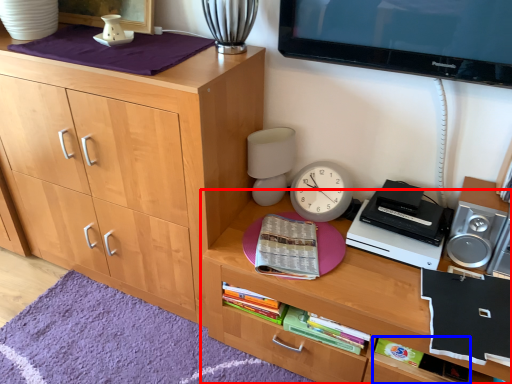
Question: Among these objects, which one is farthest to the camera, desk (highlighted by a red box) or book (highlighted by a blue box)?

Choices:
 (A) desk
 (B) book

Answer: (B)